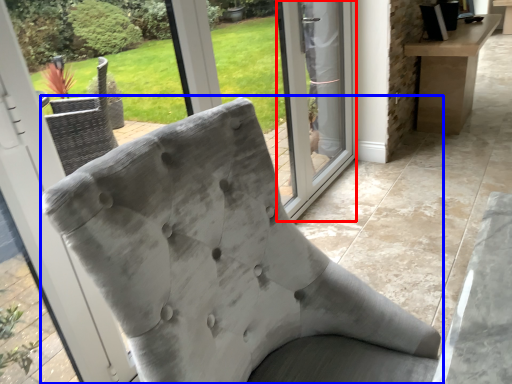
Question: Which object is closer to the camera taking this photo, screen door (highlighted by a red box) or chair (highlighted by a blue box)?

Choices:
 (A) screen door
 (B) chair

Answer: (B)